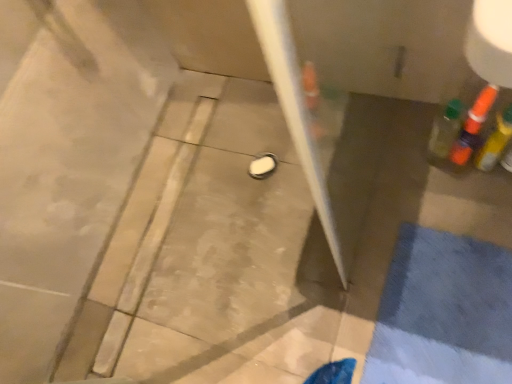
At what (x,y) coordinates should I click in order to perform the action: click on vacant space to the left of translucent orange bottle at right, which appears as the 1th bottle when viewed from the right. Please return your answer as a coordinate pair (x, y). This screenshot has width=512, height=384. Looking at the image, I should click on (444, 194).